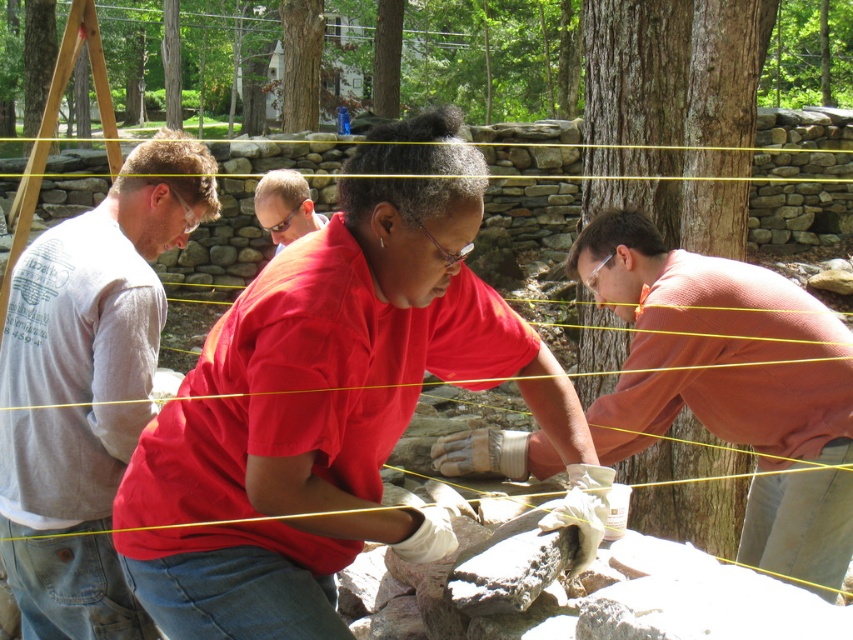
You are a photographer positioned behind the group and want to capture a clear photo of the matte black glasses at center without the gray cotton shirt at left blocking it. How should you adjust your position?

The gray cotton shirt at left is in front of matte black glasses at center, so you should move to the right side to position yourself behind the matte black glasses at center and avoid the obstruction from the gray cotton shirt at left.

You are standing at the origin point in the image. You need to move towards the point labeled as point (447, 234) first, then proceed to point (310, 221). Which direction should you go first to reach the first point?

To reach point (447, 234) first, you should move forward since it is in front of point (310, 221).

You are a photographer trying to capture a group photo of the matte gray shirt at center and the matte orange shirt at center. Which person should you focus on first if you want to ensure both are in frame without moving the camera?

You should focus on the matte orange shirt at center first because it is larger in size compared to the matte gray shirt at center, ensuring it fits within the frame before adjusting for the smaller one.